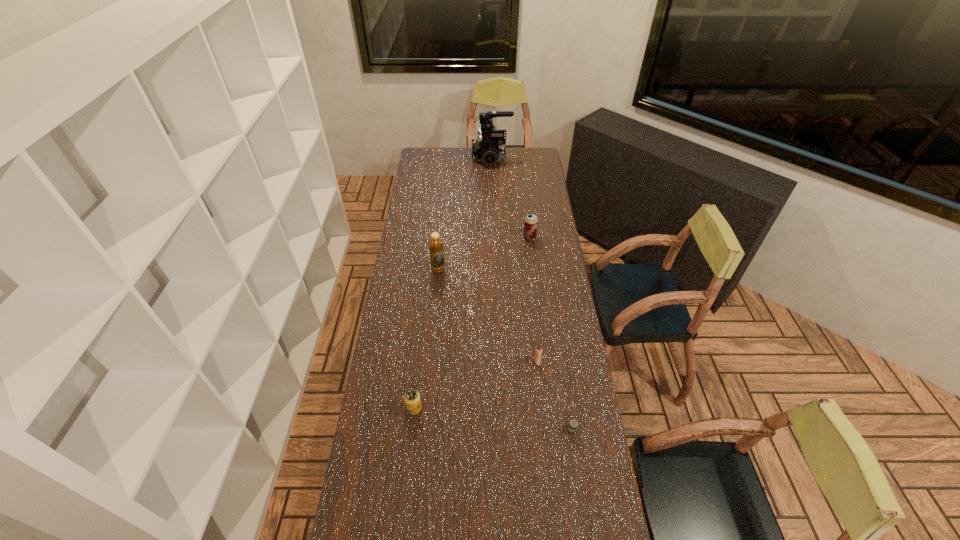
Locate an element on the screen. Image resolution: width=960 pixels, height=540 pixels. free space between the tallest beer can and the fourth object from right to left is located at coordinates (511, 197).

The height and width of the screenshot is (540, 960). I want to click on free spot between the leftmost beer can and the farthest beer can, so click(472, 322).

You are a GUI agent. You are given a task and a screenshot of the screen. Output one action in this format:
    pyautogui.click(x=<x>, y=<y>)
    Task: Click on the unoccupied position between the fourth farthest object and the second tallest beer can
    This screenshot has width=960, height=540.
    Given the screenshot: What is the action you would take?
    pyautogui.click(x=475, y=385)

This screenshot has width=960, height=540. I want to click on free space between the igniter and the second farthest object, so click(533, 299).

You are a GUI agent. You are given a task and a screenshot of the screen. Output one action in this format:
    pyautogui.click(x=<x>, y=<y>)
    Task: Click on the vacant space that's between the farthest object and the bottle
    This screenshot has width=960, height=540.
    Given the screenshot: What is the action you would take?
    tap(465, 213)

Select which object appears as the fifth closest to the farthest object. Please provide its 2D coordinates. Your answer should be formatted as a tuple, i.e. [(x, y)], where the tuple contains the x and y coordinates of a point satisfying the conditions above.

[(573, 424)]

Select which object is the fourth closest to the shortest beer can. Please provide its 2D coordinates. Your answer should be formatted as a tuple, i.e. [(x, y)], where the tuple contains the x and y coordinates of a point satisfying the conditions above.

[(531, 221)]

Identify the location of beer can that stands as the closest to the tallest beer can. The image size is (960, 540). (573, 424).

Where is `beer can that is the closest one to the farthest object`? The height and width of the screenshot is (540, 960). beer can that is the closest one to the farthest object is located at coordinates (531, 221).

This screenshot has width=960, height=540. I want to click on vacant space that satisfies the following two spatial constraints: 1. on the lens mount of the shortest object; 2. on the left side of the farthest object, so click(500, 430).